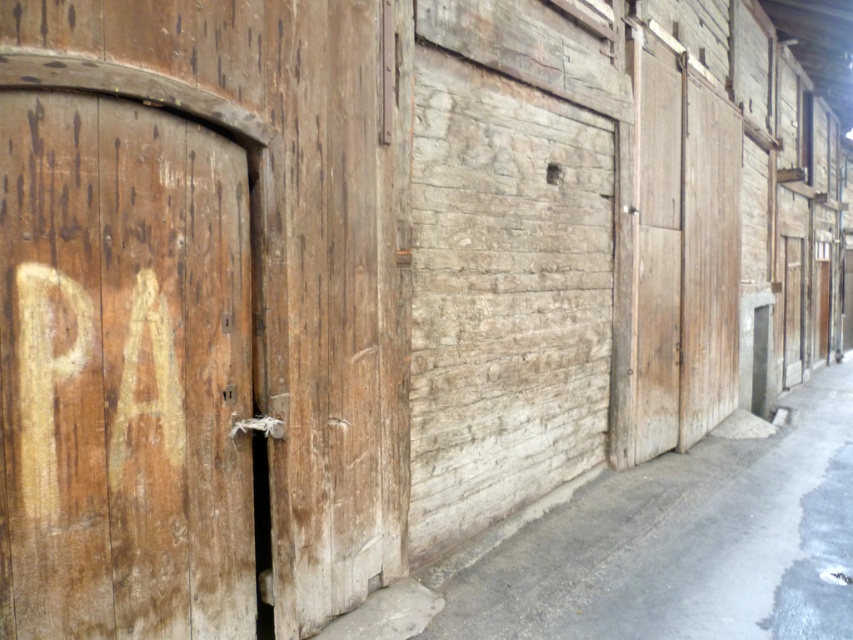
Does wooden door at left lie behind wooden door at center?

No, wooden door at left is in front of wooden door at center.

Consider the image. Which is above, wooden door at left or wooden door at center?

wooden door at center is above.

Which is behind, point (363, 472) or point (675, 346)?

The point (675, 346) is behind.

Find the location of a particular element. Image resolution: width=853 pixels, height=640 pixels. wooden door at left is located at coordinates (196, 314).